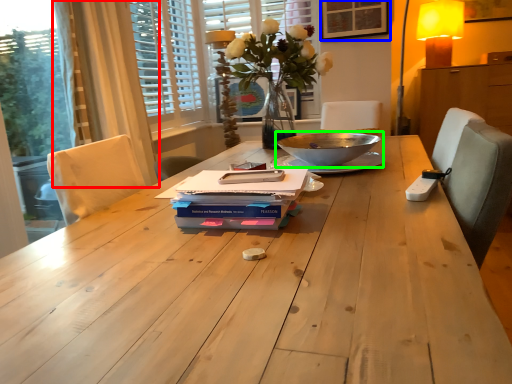
Question: Which object is positioned farthest from curtain (highlighted by a red box)? Select from picture frame (highlighted by a blue box) and bowl (highlighted by a green box).

Choices:
 (A) picture frame
 (B) bowl

Answer: (A)